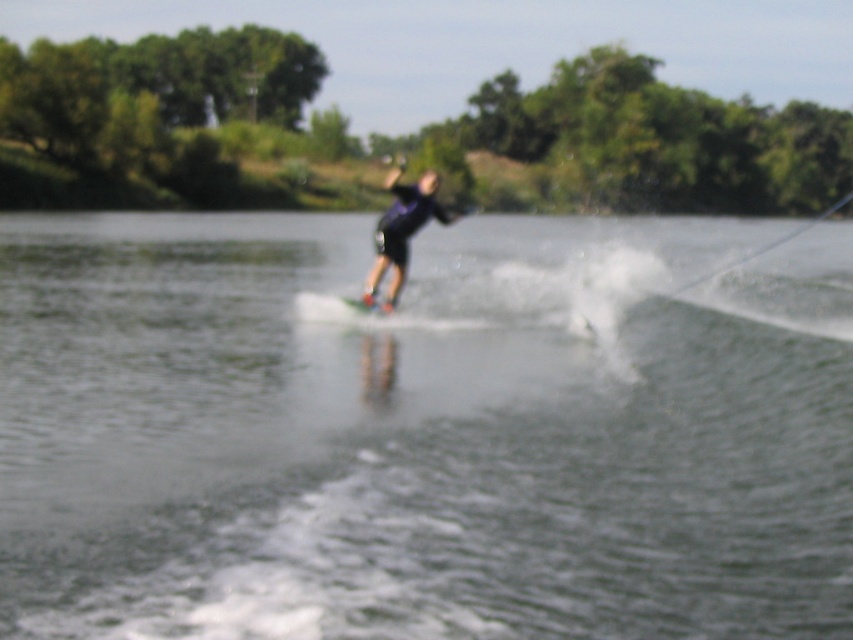
Who is taller, dark blue fabric at center or white matte water ski at center?

Standing taller between the two is dark blue fabric at center.

Is point (374, 248) closer to camera compared to point (379, 310)?

That is True.

Describe the element at coordinates (402, 228) in the screenshot. I see `dark blue fabric at center` at that location.

Where is `dark blue fabric at center`? The image size is (853, 640). dark blue fabric at center is located at coordinates (402, 228).

Can you confirm if clear water at center is positioned above dark blue fabric at center?

Actually, clear water at center is below dark blue fabric at center.

The image size is (853, 640). What do you see at coordinates (422, 429) in the screenshot?
I see `clear water at center` at bounding box center [422, 429].

Find the location of a particular element. clear water at center is located at coordinates (422, 429).

Can you confirm if clear water at center is positioned to the left of white matte water ski at center?

Correct, you'll find clear water at center to the left of white matte water ski at center.

Is the position of clear water at center more distant than that of white matte water ski at center?

No, clear water at center is in front of white matte water ski at center.

Is point (839, 312) positioned before point (347, 301)?

No, (839, 312) is behind (347, 301).

The height and width of the screenshot is (640, 853). I want to click on clear water at center, so click(x=422, y=429).